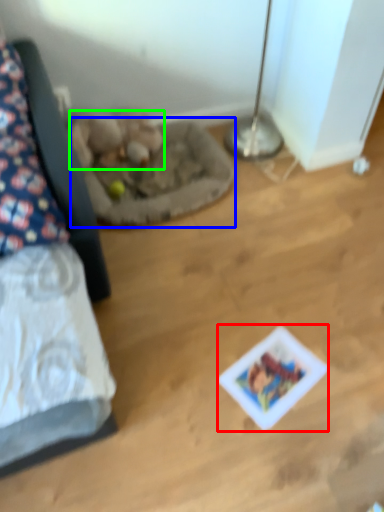
Question: Which object is positioned closest to card game (highlighted by a red box)? Select from cat bed (highlighted by a blue box) and animal (highlighted by a green box).

Choices:
 (A) cat bed
 (B) animal

Answer: (A)